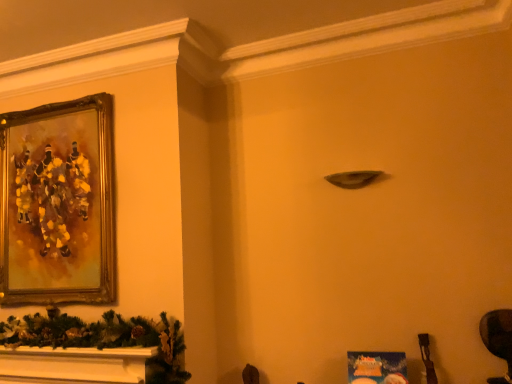
Image resolution: width=512 pixels, height=384 pixels. Describe the element at coordinates (498, 339) in the screenshot. I see `dark brown leather swivel chair at lower right` at that location.

Locate an element on the screen. Image resolution: width=512 pixels, height=384 pixels. dark brown leather swivel chair at lower right is located at coordinates (498, 339).

Describe the element at coordinates (58, 203) in the screenshot. I see `gold-framed painting at upper left` at that location.

Identify the location of gold-framed painting at upper left. (58, 203).

Identify the location of dark brown leather swivel chair at lower right. (498, 339).

Can you confirm if gold-framed painting at upper left is positioned to the left of dark brown leather swivel chair at lower right?

Indeed, gold-framed painting at upper left is positioned on the left side of dark brown leather swivel chair at lower right.

Is the depth of gold-framed painting at upper left greater than that of dark brown leather swivel chair at lower right?

Yes, it is behind dark brown leather swivel chair at lower right.

Which is nearer, (66, 261) or (511, 365)?

Point (66, 261) is farther from the camera than point (511, 365).

From the image's perspective, is gold-framed painting at upper left beneath dark brown leather swivel chair at lower right?

Incorrect, from the image's perspective, gold-framed painting at upper left is higher than dark brown leather swivel chair at lower right.

From a real-world perspective, does gold-framed painting at upper left stand above dark brown leather swivel chair at lower right?

Yes, from a real-world perspective, gold-framed painting at upper left is above dark brown leather swivel chair at lower right.

Considering the sizes of gold-framed painting at upper left and dark brown leather swivel chair at lower right in the image, is gold-framed painting at upper left wider or thinner than dark brown leather swivel chair at lower right?

Clearly, gold-framed painting at upper left has more width compared to dark brown leather swivel chair at lower right.

Does gold-framed painting at upper left have a greater height compared to dark brown leather swivel chair at lower right?

Correct, gold-framed painting at upper left is much taller as dark brown leather swivel chair at lower right.

Considering the relative sizes of gold-framed painting at upper left and dark brown leather swivel chair at lower right in the image provided, is gold-framed painting at upper left smaller than dark brown leather swivel chair at lower right?

Incorrect, gold-framed painting at upper left is not smaller in size than dark brown leather swivel chair at lower right.

Is gold-framed painting at upper left inside the boundaries of dark brown leather swivel chair at lower right, or outside?

gold-framed painting at upper left is spatially situated outside dark brown leather swivel chair at lower right.

Are gold-framed painting at upper left and dark brown leather swivel chair at lower right making contact?

gold-framed painting at upper left and dark brown leather swivel chair at lower right are clearly separated.

Is gold-framed painting at upper left looking in the opposite direction of dark brown leather swivel chair at lower right?

That's not correct — gold-framed painting at upper left is not looking away from dark brown leather swivel chair at lower right.

In the scene shown: How far apart are gold-framed painting at upper left and dark brown leather swivel chair at lower right?

gold-framed painting at upper left and dark brown leather swivel chair at lower right are 6.83 feet apart.

Where is `swivel chair on the right of gold-framed painting at upper left`? The width and height of the screenshot is (512, 384). swivel chair on the right of gold-framed painting at upper left is located at coordinates (498, 339).

Considering the relative positions of dark brown leather swivel chair at lower right and gold-framed painting at upper left in the image provided, is dark brown leather swivel chair at lower right to the left or to the right of gold-framed painting at upper left?

dark brown leather swivel chair at lower right is positioned on gold-framed painting at upper left's right side.

Between dark brown leather swivel chair at lower right and gold-framed painting at upper left, which one is positioned in front?

Positioned in front is dark brown leather swivel chair at lower right.

Considering the points (509, 355) and (22, 303), which point is behind, point (509, 355) or point (22, 303)?

The point (22, 303) is behind.

From the image's perspective, is dark brown leather swivel chair at lower right under gold-framed painting at upper left?

Yes.

From a real-world perspective, which is physically below, dark brown leather swivel chair at lower right or gold-framed painting at upper left?

dark brown leather swivel chair at lower right is physically lower.

Based on the photo, considering the sizes of objects dark brown leather swivel chair at lower right and gold-framed painting at upper left in the image provided, who is wider, dark brown leather swivel chair at lower right or gold-framed painting at upper left?

With larger width is gold-framed painting at upper left.

Considering the relative sizes of dark brown leather swivel chair at lower right and gold-framed painting at upper left in the image provided, is dark brown leather swivel chair at lower right shorter than gold-framed painting at upper left?

Correct, dark brown leather swivel chair at lower right is not as tall as gold-framed painting at upper left.

Which of these two, dark brown leather swivel chair at lower right or gold-framed painting at upper left, is bigger?

gold-framed painting at upper left.

Is dark brown leather swivel chair at lower right surrounding gold-framed painting at upper left?

No, gold-framed painting at upper left is located outside of dark brown leather swivel chair at lower right.

Is dark brown leather swivel chair at lower right far from gold-framed painting at upper left?

Indeed, dark brown leather swivel chair at lower right is not near gold-framed painting at upper left.

Consider the image. Is dark brown leather swivel chair at lower right facing away from gold-framed painting at upper left?

dark brown leather swivel chair at lower right does not have its back to gold-framed painting at upper left.

Where is `swivel chair in front of the gold-framed painting at upper left`? swivel chair in front of the gold-framed painting at upper left is located at coordinates (498, 339).

This screenshot has height=384, width=512. I want to click on swivel chair below the gold-framed painting at upper left (from the image's perspective), so click(x=498, y=339).

Find the location of `swivel chair below the gold-framed painting at upper left (from a real-world perspective)`. swivel chair below the gold-framed painting at upper left (from a real-world perspective) is located at coordinates [x=498, y=339].